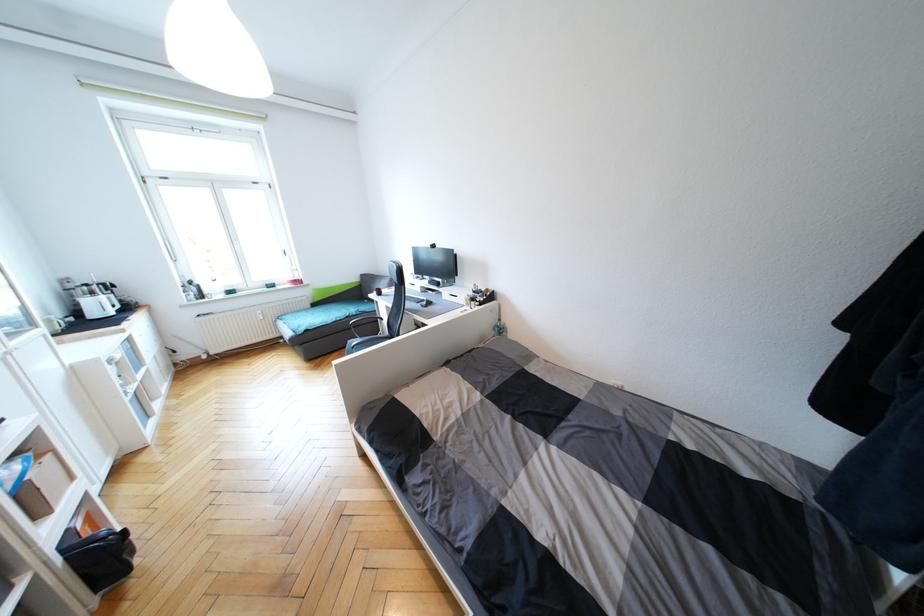
Where would you grasp the black chair armrest? Please return your answer as a coordinate pair (x, y).

(372, 317)